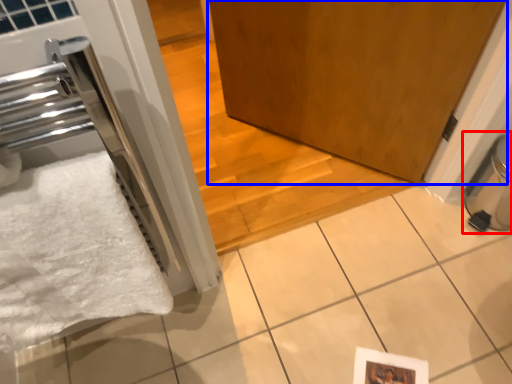
Question: Which object is further to the camera taking this photo, water heater (highlighted by a red box) or door (highlighted by a blue box)?

Choices:
 (A) water heater
 (B) door

Answer: (B)